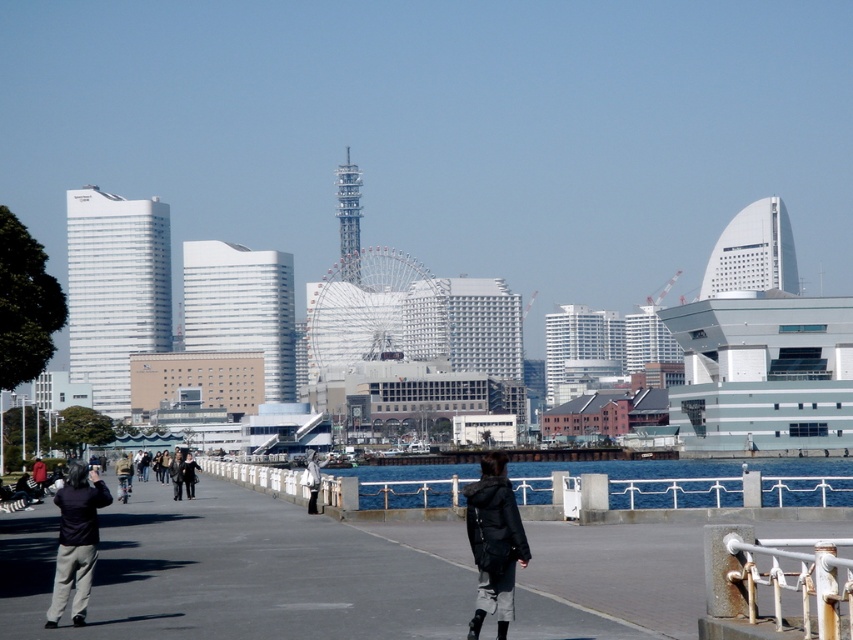
Consider the image. You are a photographer positioned at the edge of the walkway. You notice a person wearing a black matte jacket at center and dark gray pants at lower left. Which piece of clothing is higher in the image?

The black matte jacket at center is higher in the image as it is positioned above the dark gray pants at lower left.